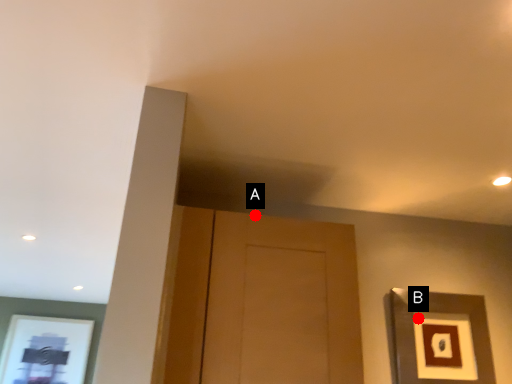
Question: Two points are circled on the image, labeled by A and B beside each circle. Which point is further to the camera?

Choices:
 (A) A is further
 (B) B is further

Answer: (B)